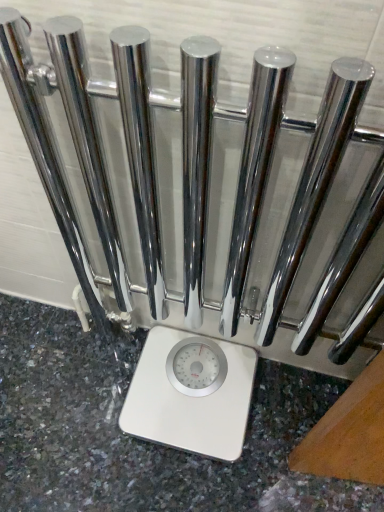
Question: Is white glossy scale at center taller or shorter than white glossy granite at center?

Choices:
 (A) short
 (B) tall

Answer: (B)

Question: Visually, is white glossy scale at center positioned to the left or to the right of white glossy granite at center?

Choices:
 (A) left
 (B) right

Answer: (B)

Question: From a real-world perspective, is white glossy scale at center above or below white glossy granite at center?

Choices:
 (A) below
 (B) above

Answer: (B)

Question: From the image's perspective, is white glossy granite at center positioned above or below white glossy scale at center?

Choices:
 (A) below
 (B) above

Answer: (A)

Question: Considering the relative positions of white glossy granite at center and white glossy scale at center in the image provided, is white glossy granite at center to the left or to the right of white glossy scale at center?

Choices:
 (A) right
 (B) left

Answer: (B)

Question: Is point (223, 504) positioned closer to the camera than point (208, 343)?

Choices:
 (A) farther
 (B) closer

Answer: (B)

Question: In terms of height, does white glossy granite at center look taller or shorter compared to white glossy scale at center?

Choices:
 (A) tall
 (B) short

Answer: (B)